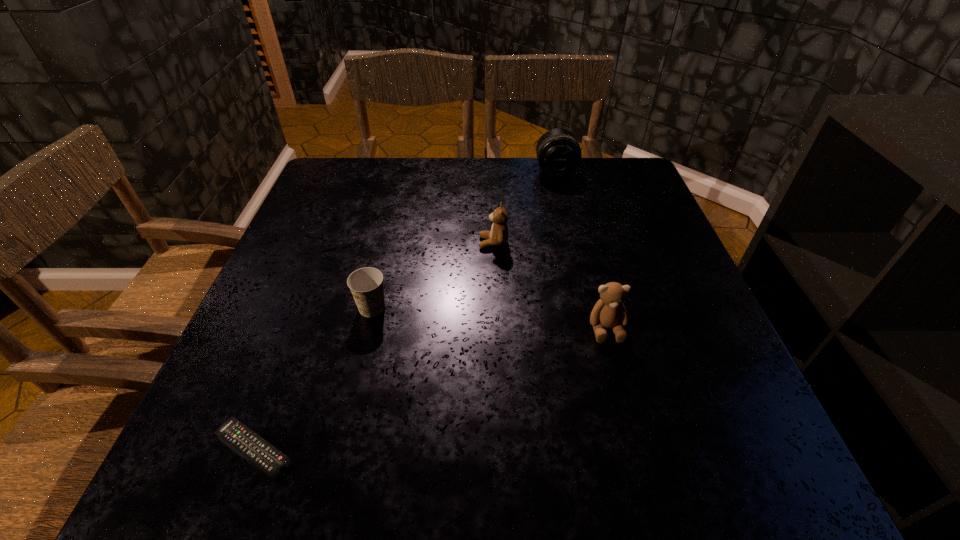
Where is `vacant space situated on the front-facing side of the left teddy bear`? This screenshot has height=540, width=960. vacant space situated on the front-facing side of the left teddy bear is located at coordinates (415, 243).

Locate an element on the screen. This screenshot has height=540, width=960. blank space located on the front-facing side of the left teddy bear is located at coordinates (458, 243).

Where is `vacant space located on the front-facing side of the right teddy bear`? The image size is (960, 540). vacant space located on the front-facing side of the right teddy bear is located at coordinates (645, 476).

What are the coordinates of `vacant region located 0.400m on the right of the Dixie cup` in the screenshot? It's located at (588, 308).

Locate an element on the screen. free space located on the back of the shortest object is located at coordinates [x=325, y=259].

Where is `object that is positioned at the far edge`? The height and width of the screenshot is (540, 960). object that is positioned at the far edge is located at coordinates (558, 152).

Where is `object located in the near edge section of the desktop`? The height and width of the screenshot is (540, 960). object located in the near edge section of the desktop is located at coordinates (261, 453).

Locate an element on the screen. object that is positioned at the left edge is located at coordinates (261, 453).

You are a GUI agent. You are given a task and a screenshot of the screen. Output one action in this format:
    pyautogui.click(x=<x>, y=<y>)
    Task: Click on the object situated at the near left corner
    Image resolution: width=960 pixels, height=540 pixels.
    Given the screenshot: What is the action you would take?
    pyautogui.click(x=261, y=453)

Find the location of a particular element. free region at the far edge of the desktop is located at coordinates (447, 167).